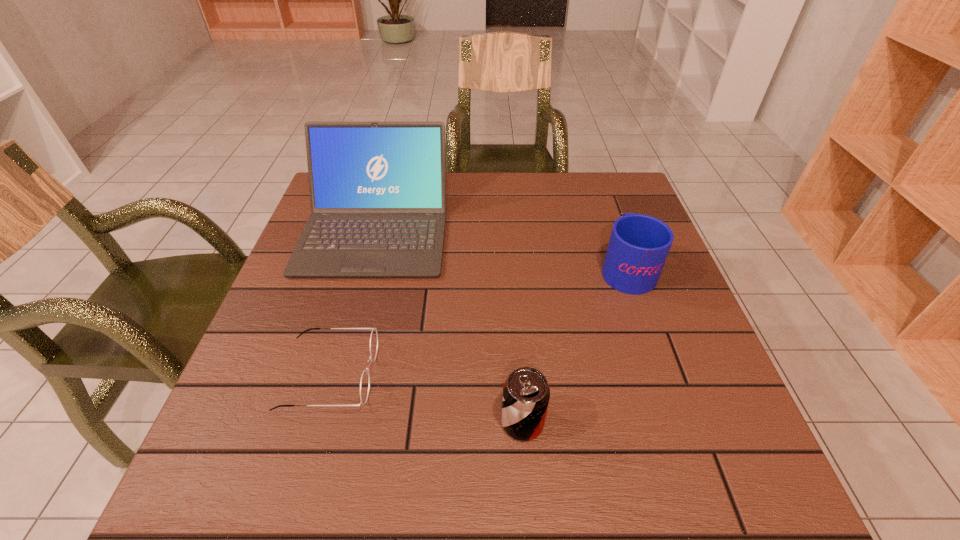
At what (x,y) coordinates should I click in order to perform the action: click on vacant space in between the second object from right to left and the tallest object. Please return your answer as a coordinate pair (x, y). Looking at the image, I should click on (449, 326).

Where is `empty location between the mug and the shortest object`? This screenshot has height=540, width=960. empty location between the mug and the shortest object is located at coordinates (478, 321).

This screenshot has width=960, height=540. I want to click on object that can be found as the third closest to the rightmost object, so click(x=365, y=378).

Image resolution: width=960 pixels, height=540 pixels. In order to click on the third closest object to the spectacles in this screenshot , I will do `click(639, 244)`.

Where is `free spot that satisfies the following two spatial constraints: 1. on the screen of the laptop computer; 2. on the front-facing side of the spectacles`? This screenshot has width=960, height=540. free spot that satisfies the following two spatial constraints: 1. on the screen of the laptop computer; 2. on the front-facing side of the spectacles is located at coordinates (336, 374).

Image resolution: width=960 pixels, height=540 pixels. I want to click on free space in the image that satisfies the following two spatial constraints: 1. on the screen of the laptop computer; 2. on the left side of the second object from right to left, so pyautogui.click(x=323, y=422).

At what (x,y) coordinates should I click in order to perform the action: click on free location that satisfies the following two spatial constraints: 1. on the front-facing side of the shortest object; 2. on the right side of the soda can. Please return your answer as a coordinate pair (x, y). Looking at the image, I should click on (316, 422).

This screenshot has width=960, height=540. In order to click on blank area in the image that satisfies the following two spatial constraints: 1. on the front-facing side of the spectacles; 2. on the right side of the third object from left to right in this screenshot , I will do `click(316, 422)`.